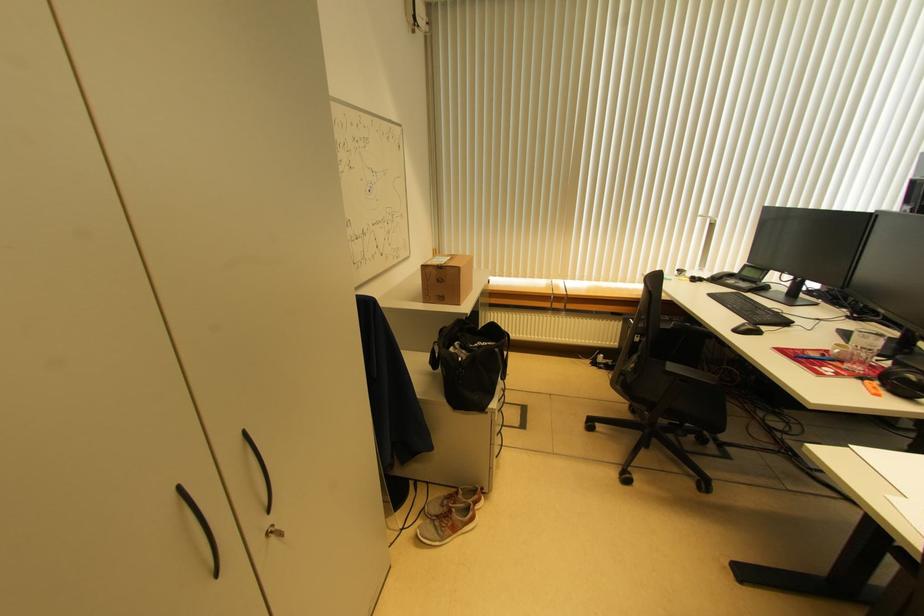
Identify the location of chair sitting surface. The width and height of the screenshot is (924, 616). (694, 398).